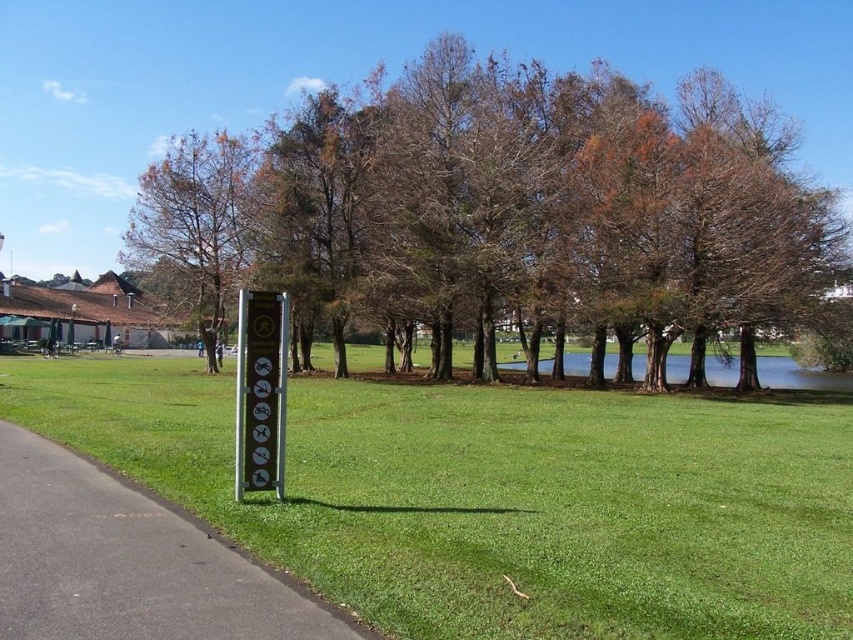
You are standing at the entrance of the park and see two points marked in the image. The first point is at coordinate point (144, 499) and the second is at point (804, 372). Which point is nearer to you?

Point (144, 499) is closer to the viewer than point (804, 372).

You are planning to set up a picnic blanket in the park. Considering the black asphalt at lower left and the green grassy lake at center, which area would provide more space for your blanket?

The green grassy lake at center is larger than the black asphalt at lower left, so it offers more space for the picnic blanket.

You are a gardener planning to mow the green grassy lake at center and the black asphalt at lower left. Which area requires a wider mower path?

The green grassy lake at center requires a wider mower path because it is wider than the black asphalt at lower left.